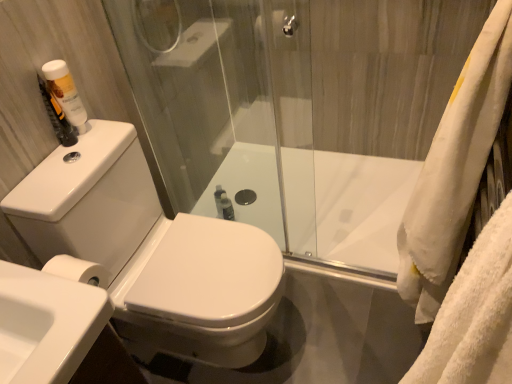
What is the approximate height of white fluffy bath towel at right?

The height of white fluffy bath towel at right is 34.66 inches.

Describe the element at coordinates (46, 324) in the screenshot. I see `white glossy sink at lower left` at that location.

Find the location of a particular element. This screenshot has width=512, height=384. white glossy toilet at center is located at coordinates coord(151,250).

Could you tell me if white glossy bathtub at center is turned towards white fluffy bath towel at right?

No, white glossy bathtub at center is not oriented towards white fluffy bath towel at right.

From the image's perspective, is white glossy bathtub at center below white fluffy bath towel at right?

Yes, from the image's perspective, white glossy bathtub at center is below white fluffy bath towel at right.

Between white glossy bathtub at center and white fluffy bath towel at right, which one has more height?

With more height is white fluffy bath towel at right.

Between point (295, 47) and point (187, 341), which one is positioned in front?

The point (187, 341) is closer to the camera.

In terms of width, does transparent glass shower door at upper right look wider or thinner when compared to white glossy toilet at center?

In the image, transparent glass shower door at upper right appears to be more narrow than white glossy toilet at center.

Is the depth of transparent glass shower door at upper right less than that of white glossy toilet at center?

No, it is behind white glossy toilet at center.

Is transparent glass shower door at upper right taller or shorter than white glossy sink at lower left?

Considering their sizes, transparent glass shower door at upper right has more height than white glossy sink at lower left.

Can you tell me how much transparent glass shower door at upper right and white glossy sink at lower left differ in facing direction?

transparent glass shower door at upper right and white glossy sink at lower left are facing 90.1 degrees away from each other.

Visually, is transparent glass shower door at upper right positioned to the left or to the right of white glossy sink at lower left?

transparent glass shower door at upper right is positioned on white glossy sink at lower left's right side.

From the image's perspective, is transparent glass shower door at upper right located above or below white glossy sink at lower left?

transparent glass shower door at upper right is situated higher than white glossy sink at lower left in the image.

Considering their positions, is white plastic bottle at upper left located in front of or behind white glossy sink at lower left?

white plastic bottle at upper left is positioned farther from the viewer than white glossy sink at lower left.

From the image's perspective, is white plastic bottle at upper left below white glossy sink at lower left?

Incorrect, from the image's perspective, white plastic bottle at upper left is higher than white glossy sink at lower left.

Does point (60, 87) appear closer or farther from the camera than point (83, 356)?

Point (60, 87) is positioned farther from the camera compared to point (83, 356).

Does white plastic bottle at upper left have a greater height compared to white glossy sink at lower left?

Yes, white plastic bottle at upper left is taller than white glossy sink at lower left.

From the image's perspective, is white plastic bottle at upper left above or below white glossy bathtub at center?

From the image's perspective, white plastic bottle at upper left appears above white glossy bathtub at center.

Considering the sizes of white plastic bottle at upper left and white glossy bathtub at center in the image, is white plastic bottle at upper left bigger or smaller than white glossy bathtub at center?

Clearly, white plastic bottle at upper left is smaller in size than white glossy bathtub at center.

Considering the positions of objects white plastic bottle at upper left and white glossy bathtub at center in the image provided, who is behind, white plastic bottle at upper left or white glossy bathtub at center?

white glossy bathtub at center.

Does white plastic bottle at upper left have a greater width compared to white glossy bathtub at center?

In fact, white plastic bottle at upper left might be narrower than white glossy bathtub at center.

Is white glossy toilet at center facing away from transparent glass shower door at upper right?

white glossy toilet at center does not have its back to transparent glass shower door at upper right.

Is white glossy toilet at center placed right next to transparent glass shower door at upper right?

white glossy toilet at center and transparent glass shower door at upper right are clearly separated.

Considering the relative positions of white glossy toilet at center and transparent glass shower door at upper right in the image provided, is white glossy toilet at center to the right of transparent glass shower door at upper right from the viewer's perspective?

No, white glossy toilet at center is not to the right of transparent glass shower door at upper right.

Which object is closer to the camera, white glossy toilet at center or transparent glass shower door at upper right?

white glossy toilet at center.

Does white glossy sink at lower left appear on the left side of white glossy toilet at center?

Yes, white glossy sink at lower left is to the left of white glossy toilet at center.

From a real-world perspective, is white glossy sink at lower left physically located above or below white glossy toilet at center?

white glossy sink at lower left is above white glossy toilet at center.

Which is further, (68, 301) or (236, 247)?

The point (236, 247) is behind.

You are a GUI agent. You are given a task and a screenshot of the screen. Output one action in this format:
    pyautogui.click(x=<x>, y=<y>)
    Task: Click on the sink that is above the white glossy toilet at center (from the image's perspective)
    Image resolution: width=512 pixels, height=384 pixels.
    Given the screenshot: What is the action you would take?
    pyautogui.click(x=46, y=324)

Find the location of a particular element. bath towel above the white glossy bathtub at center (from a real-world perspective) is located at coordinates click(454, 169).

Find the location of a particular element. The width and height of the screenshot is (512, 384). shower door on the right of the white glossy toilet at center is located at coordinates (287, 91).

Which object lies further to the anchor point transparent glass shower door at upper right, white fluffy bath towel at right or white glossy toilet at center?

The object further to transparent glass shower door at upper right is white fluffy bath towel at right.

Looking at the image, which one is located further to white glossy toilet at center, white glossy sink at lower left or white glossy bathtub at center?

white glossy bathtub at center.

When comparing their distances from white plastic bottle at upper left, does transparent glass shower door at upper right or white glossy bathtub at center seem further?

white glossy bathtub at center lies further to white plastic bottle at upper left than the other object.

Based on their spatial positions, is white fluffy bath towel at right or transparent glass shower door at upper right closer to white glossy sink at lower left?

white fluffy bath towel at right is positioned closer to the anchor white glossy sink at lower left.

Estimate the real-world distances between objects in this image. Which object is further from white glossy bathtub at center, white glossy sink at lower left or transparent glass shower door at upper right?

Based on the image, white glossy sink at lower left appears to be further to white glossy bathtub at center.

Considering their positions, is white glossy bathtub at center positioned further to white glossy toilet at center than white fluffy bath towel at right?

white fluffy bath towel at right is positioned further to the anchor white glossy toilet at center.

Based on their spatial positions, is white glossy bathtub at center or white plastic bottle at upper left further from white glossy toilet at center?

white glossy bathtub at center.

From the image, which object appears to be nearer to transparent glass shower door at upper right, white glossy bathtub at center or white glossy toilet at center?

white glossy bathtub at center lies closer to transparent glass shower door at upper right than the other object.

Where is `porcelain located between white plastic bottle at upper left and white fluffy bath towel at right in the left-right direction`? The width and height of the screenshot is (512, 384). porcelain located between white plastic bottle at upper left and white fluffy bath towel at right in the left-right direction is located at coordinates (151, 250).

The height and width of the screenshot is (384, 512). I want to click on sink between white plastic bottle at upper left and transparent glass shower door at upper right in the horizontal direction, so click(x=46, y=324).

Where is `toiletry between white glossy toilet at center and white glossy bathtub at center from front to back`? This screenshot has height=384, width=512. toiletry between white glossy toilet at center and white glossy bathtub at center from front to back is located at coordinates (65, 93).

The height and width of the screenshot is (384, 512). What are the coordinates of `porcelain between white fluffy bath towel at right and white glossy bathtub at center from front to back` in the screenshot? It's located at (151, 250).